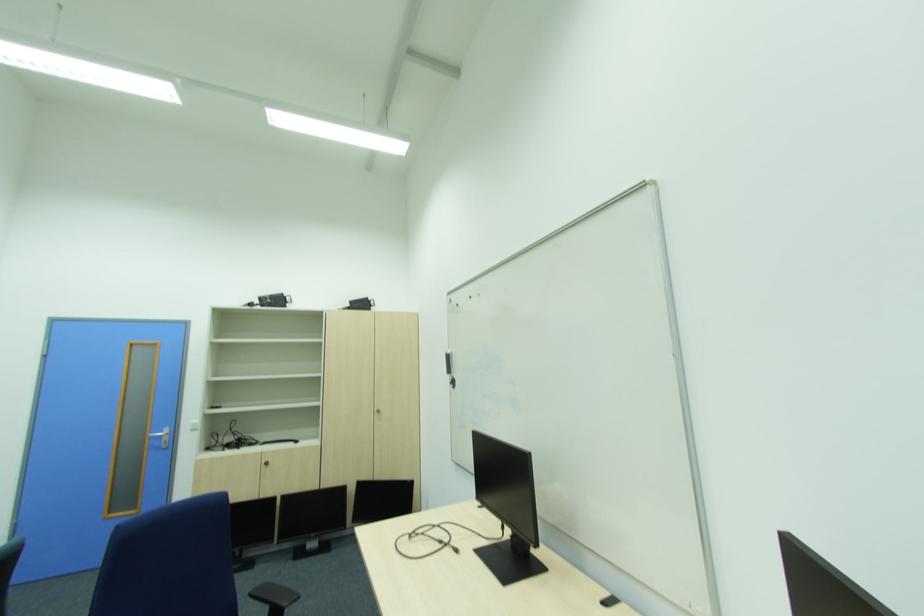
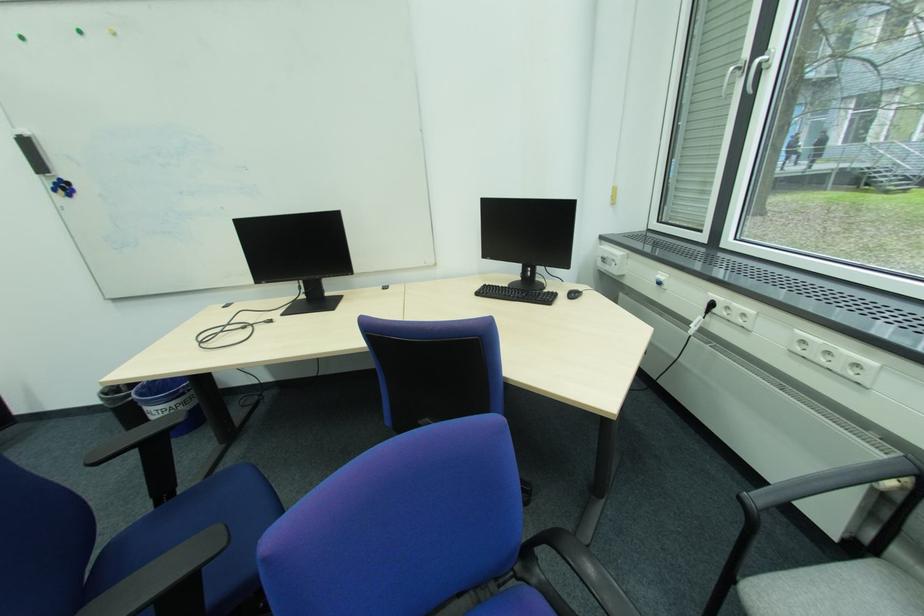
The point at (458, 381) is marked in the first image. Where is the corresponding point in the second image?

(62, 185)